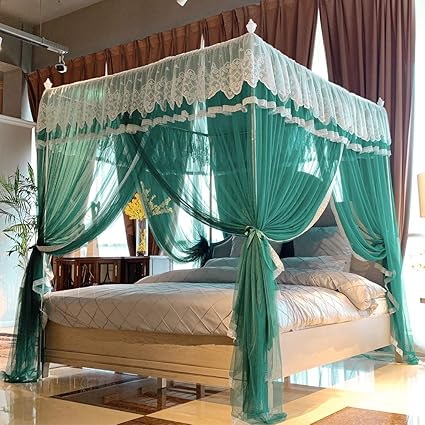
This screenshot has width=425, height=425. I want to click on blanket, so click(342, 278).